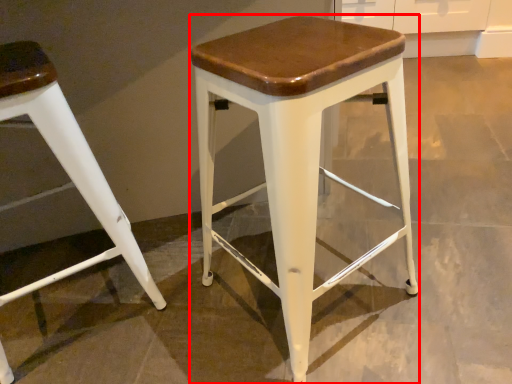
Question: From the image's perspective, what is the correct spatial positioning of stool (annotated by the red box) in reference to stool?

Choices:
 (A) above
 (B) below

Answer: (A)